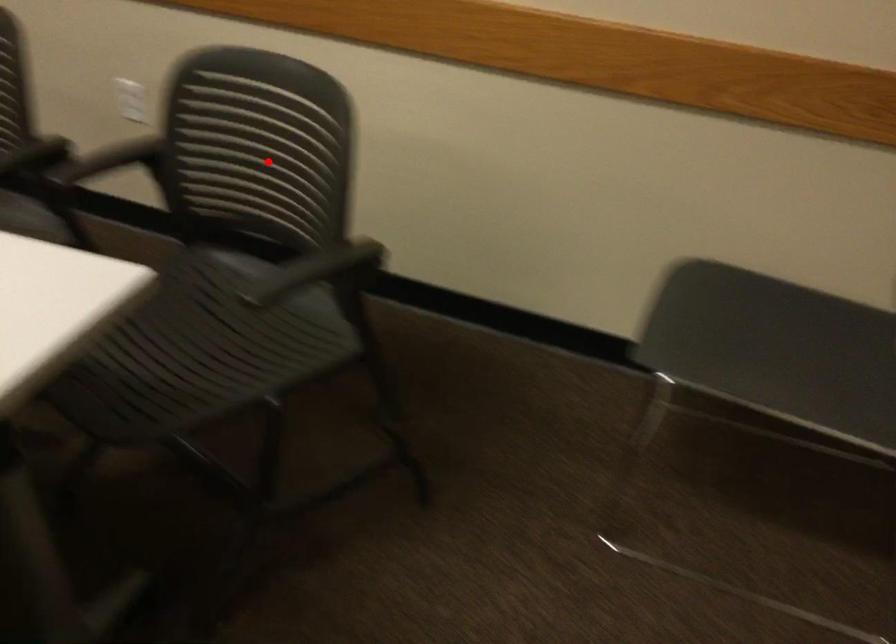
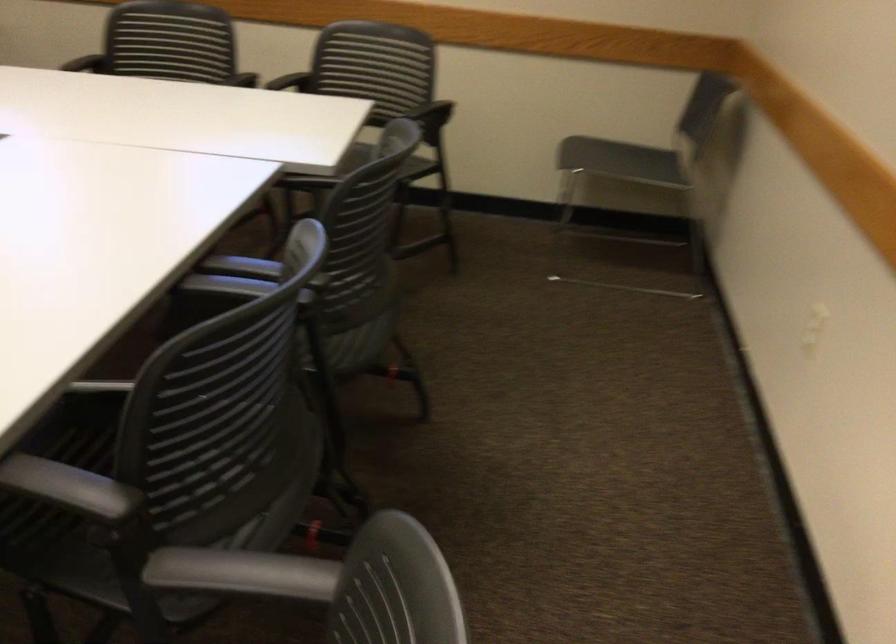
Question: I am providing you with two images of the same scene from different viewpoints. In image1, a red point is highlighted. Considering the same 3D point in image2, which of the following is correct?

Choices:
 (A) It is closer
 (B) It is farther

Answer: (B)